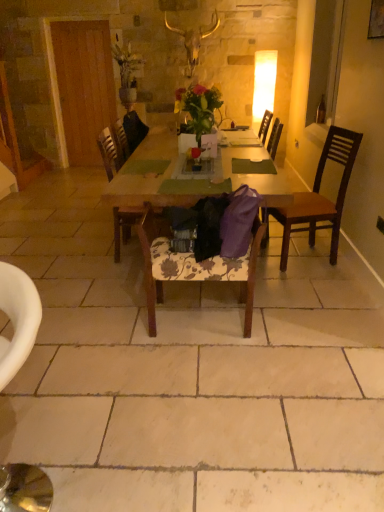
Question: Considering the positions of wooden picture frame at upper right and brown wooden chair at right, positioned as the third chair in front-to-back order, in the image, is wooden picture frame at upper right bigger or smaller than brown wooden chair at right, positioned as the third chair in front-to-back order,?

Choices:
 (A) big
 (B) small

Answer: (B)

Question: Is point (380, 10) positioned closer to the camera than point (324, 146)?

Choices:
 (A) farther
 (B) closer

Answer: (B)

Question: Estimate the real-world distances between objects in this image. Which object is farther from the wooden picture frame at upper right?

Choices:
 (A) wooden table at center
 (B) floral fabric chair at center, which is the 3th chair in back-to-front order
 (C) wooden chair at center, placed as the 1th chair when sorted from back to front
 (D) white floral fabric chair at lower left, acting as the 1th chair starting from the front
 (E) matte yellow lampshade at upper right

Answer: (D)

Question: Which object is the farthest from the matte yellow lampshade at upper right?

Choices:
 (A) brown wooden chair at right, which is the first chair in right-to-left order
 (B) vibrant floral bouquet at center
 (C) white floral fabric chair at lower left, the fourth chair viewed from the back
 (D) wooden table at center
 (E) floral fabric chair at center, arranged as the second chair when viewed from the front

Answer: (C)